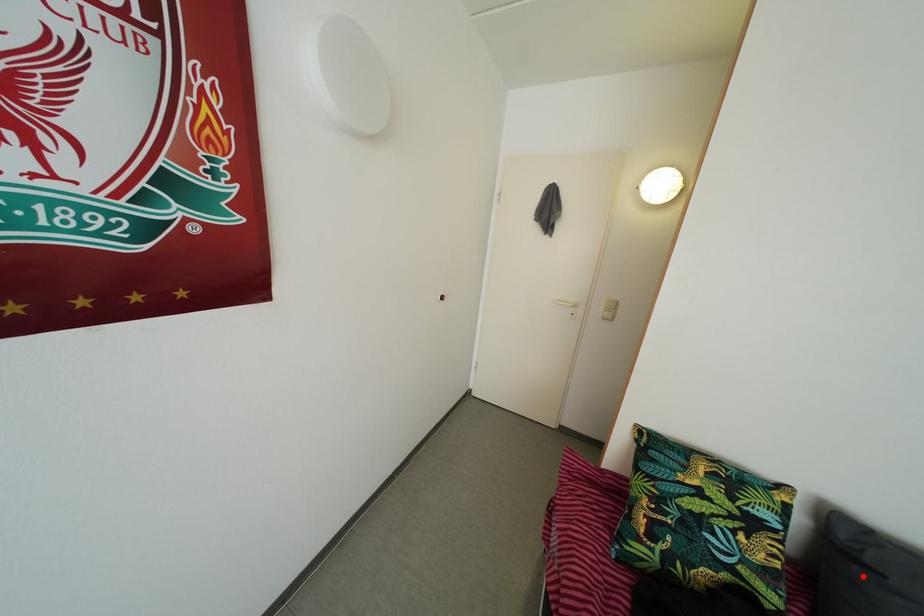
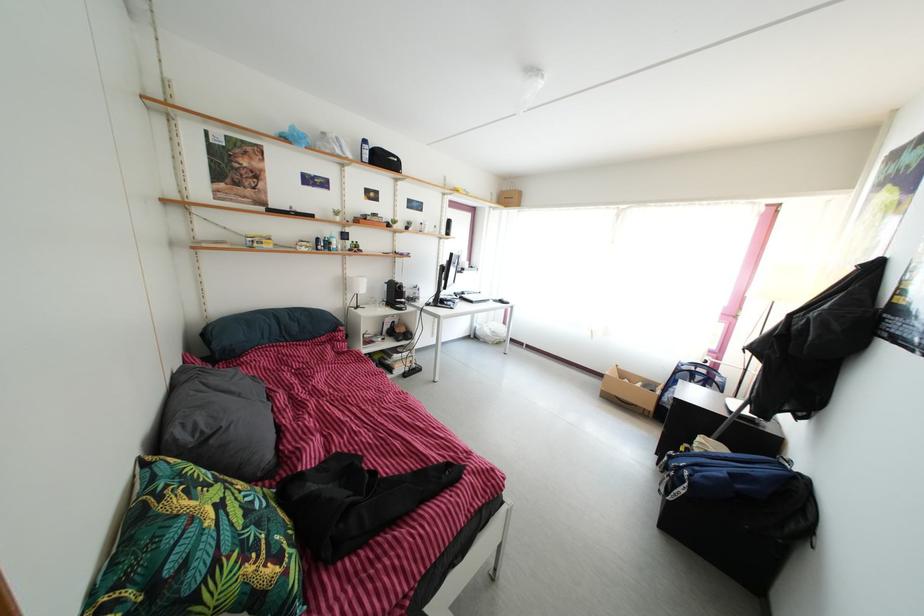
Question: I am providing you with two images of the same scene from different viewpoints. In image1, a red point is highlighted. Considering the same 3D point in image2, which of the following is correct?

Choices:
 (A) It is closer
 (B) It is farther

Answer: (B)